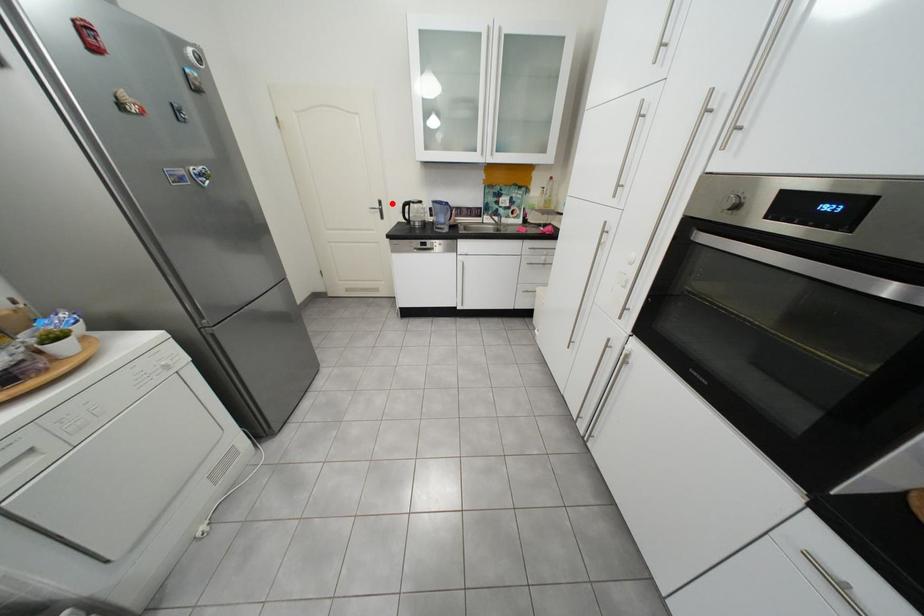
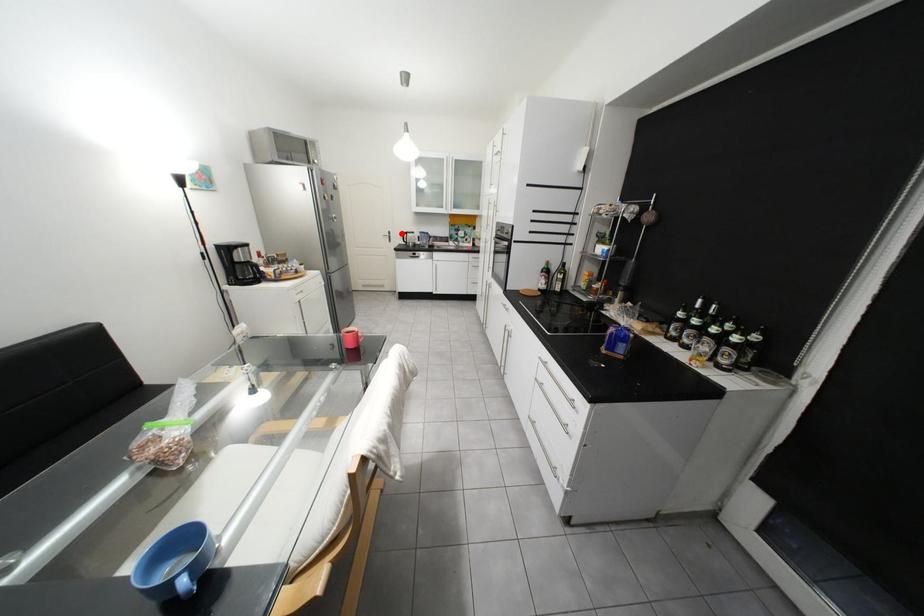
I am providing you with two images of the same scene from different viewpoints. A red point is marked on the first image and another point is marked on the second image. Is the red point in image1 aligned with the point shown in image2?

Yes